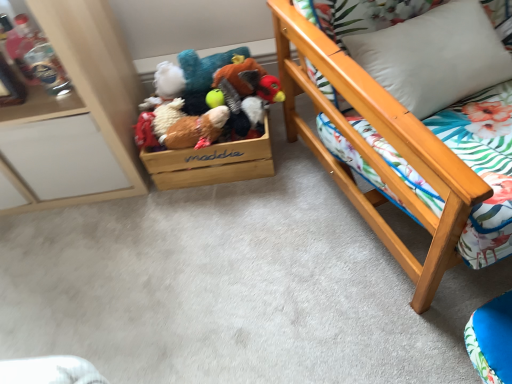
Question: Does fluffy brown plush at center, marked as the second toy in a back-to-front arrangement, come behind wooden bed frame at right, arranged as the 2th furniture when viewed from the left?

Choices:
 (A) yes
 (B) no

Answer: (A)

Question: Does fluffy brown plush at center, marked as the second toy in a back-to-front arrangement, turn towards wooden bed frame at right, arranged as the 2th furniture when viewed from the left?

Choices:
 (A) no
 (B) yes

Answer: (A)

Question: Does fluffy brown plush at center, marked as the second toy in a back-to-front arrangement, have a greater height compared to wooden bed frame at right, arranged as the 2th furniture when viewed from the left?

Choices:
 (A) yes
 (B) no

Answer: (B)

Question: Is fluffy brown plush at center, marked as the second toy in a back-to-front arrangement, to the right of wooden bed frame at right, arranged as the 2th furniture when viewed from the left, from the viewer's perspective?

Choices:
 (A) yes
 (B) no

Answer: (B)

Question: Is fluffy brown plush at center, acting as the first toy starting from the front, wider than wooden bed frame at right, arranged as the 2th furniture when viewed from the left?

Choices:
 (A) no
 (B) yes

Answer: (A)

Question: From the image's perspective, is wooden bed frame at right, arranged as the 2th furniture when viewed from the left, above or below fluffy brown plush at center, acting as the first toy starting from the front?

Choices:
 (A) below
 (B) above

Answer: (B)

Question: Is wooden bed frame at right, arranged as the 2th furniture when viewed from the left, in front of or behind fluffy brown plush at center, marked as the second toy in a back-to-front arrangement, in the image?

Choices:
 (A) front
 (B) behind

Answer: (A)

Question: From a real-world perspective, is wooden bed frame at right, arranged as the 2th furniture when viewed from the left, above or below fluffy brown plush at center, marked as the second toy in a back-to-front arrangement?

Choices:
 (A) above
 (B) below

Answer: (A)

Question: Is wooden bed frame at right, which appears as the 1th furniture when viewed from the right, bigger or smaller than fluffy brown plush at center, acting as the first toy starting from the front?

Choices:
 (A) big
 (B) small

Answer: (A)

Question: From their relative heights in the image, would you say wooden cabinet at left, the 1th furniture from the left, is taller or shorter than wooden plush toys at center, which is counted as the 2th toy, starting from the front?

Choices:
 (A) tall
 (B) short

Answer: (A)

Question: Based on their sizes in the image, would you say wooden cabinet at left, the 1th furniture from the left, is bigger or smaller than wooden plush toys at center, which is counted as the 2th toy, starting from the front?

Choices:
 (A) small
 (B) big

Answer: (B)

Question: In the image, is wooden cabinet at left, positioned as the second furniture in right-to-left order, positioned in front of or behind wooden plush toys at center, which is counted as the 2th toy, starting from the front?

Choices:
 (A) front
 (B) behind

Answer: (A)

Question: Is wooden cabinet at left, the 1th furniture from the left, inside the boundaries of wooden plush toys at center, which is counted as the 2th toy, starting from the front, or outside?

Choices:
 (A) outside
 (B) inside

Answer: (A)

Question: Is white soft pillow at upper right to the left or to the right of wooden bed frame at right, which appears as the 1th furniture when viewed from the right, in the image?

Choices:
 (A) left
 (B) right

Answer: (A)

Question: From their relative heights in the image, would you say white soft pillow at upper right is taller or shorter than wooden bed frame at right, arranged as the 2th furniture when viewed from the left?

Choices:
 (A) tall
 (B) short

Answer: (B)